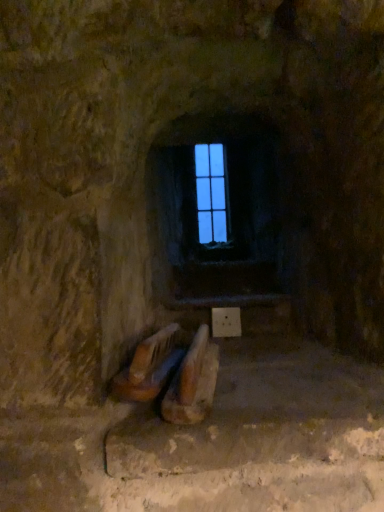
Locate an element on the screen. clear glass window at center is located at coordinates (211, 193).

What do you see at coordinates (211, 193) in the screenshot? I see `clear glass window at center` at bounding box center [211, 193].

Identify the location of wooden crate at lower center. (171, 375).

Describe the element at coordinates (171, 375) in the screenshot. This screenshot has height=512, width=384. I see `wooden crate at lower center` at that location.

What are the coordinates of `clear glass window at center` in the screenshot? It's located at coord(211,193).

Considering the relative positions of wooden crate at lower center and clear glass window at center in the image provided, is wooden crate at lower center to the left of clear glass window at center from the viewer's perspective?

Yes, wooden crate at lower center is to the left of clear glass window at center.

Is wooden crate at lower center positioned behind clear glass window at center?

No, wooden crate at lower center is closer to the camera.

Between point (188, 362) and point (215, 234), which one is positioned in front?

The point (188, 362) is in front.

From the image's perspective, is wooden crate at lower center below clear glass window at center?

Correct, wooden crate at lower center appears lower than clear glass window at center in the image.

From a real-world perspective, is wooden crate at lower center on clear glass window at center?

No, from a real-world perspective, wooden crate at lower center is not above clear glass window at center.

Between wooden crate at lower center and clear glass window at center, which one has smaller width?

clear glass window at center is thinner.

Considering the relative sizes of wooden crate at lower center and clear glass window at center in the image provided, is wooden crate at lower center shorter than clear glass window at center?

Yes, wooden crate at lower center is shorter than clear glass window at center.

Between wooden crate at lower center and clear glass window at center, which one has smaller size?

clear glass window at center.

Would you say clear glass window at center is part of wooden crate at lower center's contents?

That's incorrect, clear glass window at center is not inside wooden crate at lower center.

Is wooden crate at lower center not close to clear glass window at center?

Yes, wooden crate at lower center and clear glass window at center are located far from each other.

Is wooden crate at lower center oriented towards clear glass window at center?

No, wooden crate at lower center is not facing towards clear glass window at center.

How different are the orientations of wooden crate at lower center and clear glass window at center in degrees?

They differ by 9.84 degrees in their facing directions.

Identify the location of window frame that appears on the right of wooden crate at lower center. The width and height of the screenshot is (384, 512). (211, 193).

In the scene shown: Does clear glass window at center appear on the right side of wooden crate at lower center?

Indeed, clear glass window at center is positioned on the right side of wooden crate at lower center.

Which is behind, clear glass window at center or wooden crate at lower center?

clear glass window at center is more distant.

Is point (195, 173) more distant than point (165, 348)?

Yes, it is.

From the image's perspective, would you say clear glass window at center is shown under wooden crate at lower center?

Incorrect, from the image's perspective, clear glass window at center is higher than wooden crate at lower center.

From a real-world perspective, is clear glass window at center on top of wooden crate at lower center?

Yes, from a real-world perspective, clear glass window at center is over wooden crate at lower center

Does clear glass window at center have a lesser width compared to wooden crate at lower center?

Yes, clear glass window at center is thinner than wooden crate at lower center.

Who is taller, clear glass window at center or wooden crate at lower center?

Standing taller between the two is clear glass window at center.

Is clear glass window at center bigger or smaller than wooden crate at lower center?

Considering their sizes, clear glass window at center takes up less space than wooden crate at lower center.

Is clear glass window at center positioned beyond the bounds of wooden crate at lower center?

clear glass window at center is positioned outside wooden crate at lower center.

Is clear glass window at center in contact with wooden crate at lower center?

No, clear glass window at center is not next to wooden crate at lower center.

Is clear glass window at center turned away from wooden crate at lower center?

clear glass window at center does not have its back to wooden crate at lower center.

Measure the distance from clear glass window at center to wooden crate at lower center.

clear glass window at center is 3.83 feet from wooden crate at lower center.

Find the location of `window frame on the right of the wooden crate at lower center`. window frame on the right of the wooden crate at lower center is located at coordinates (x=211, y=193).

The height and width of the screenshot is (512, 384). I want to click on window frame on the right of wooden crate at lower center, so click(x=211, y=193).

This screenshot has height=512, width=384. I want to click on furniture on the left of clear glass window at center, so click(x=171, y=375).